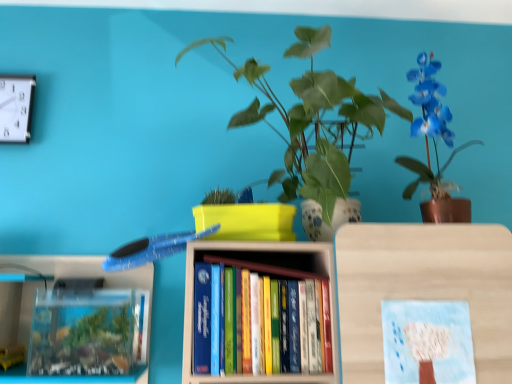
This screenshot has height=384, width=512. What are the coordinates of `pastel blue paper at center` in the screenshot? It's located at (426, 342).

Measure the distance between blue glossy orchid at upper right and camera.

The depth of blue glossy orchid at upper right is 3.54 feet.

Identify the location of green leafy plant at upper center. This screenshot has height=384, width=512. (209, 114).

Identify the location of white plastic clock at upper left. The height and width of the screenshot is (384, 512). (16, 107).

The height and width of the screenshot is (384, 512). Identify the location of pastel blue paper at center. (426, 342).

Can you confirm if green leafy plant at upper center is wider than pastel blue paper at center?

Indeed, green leafy plant at upper center has a greater width compared to pastel blue paper at center.

Is green leafy plant at upper center positioned behind pastel blue paper at center?

No, it is not.

Looking at this image, would you say green leafy plant at upper center is a long distance from pastel blue paper at center?

No, there isn't a large distance between green leafy plant at upper center and pastel blue paper at center.

At what (x,y) coordinates should I click in order to perform the action: click on backdrop on the left of pastel blue paper at center. Please return your answer as a coordinate pair (x, y). Looking at the image, I should click on (209, 114).

Does blue glossy orchid at upper right have a lesser width compared to pastel blue paper at center?

No.

In terms of height, does blue glossy orchid at upper right look taller or shorter compared to pastel blue paper at center?

Clearly, blue glossy orchid at upper right is taller compared to pastel blue paper at center.

How different are the orientations of blue glossy orchid at upper right and pastel blue paper at center in degrees?

They differ by 0.00363 degrees in their facing directions.

Which is behind, point (436, 89) or point (436, 344)?

Point (436, 89)

You are a GUI agent. You are given a task and a screenshot of the screen. Output one action in this format:
    pyautogui.click(x=<x>, y=<y>)
    Task: Click on the clock on the left side of green leafy plant at upper center
    The image size is (512, 384).
    Given the screenshot: What is the action you would take?
    pyautogui.click(x=16, y=107)

In the scene shown: Is green leafy plant at upper center surrounded by white plastic clock at upper left?

No, green leafy plant at upper center is not a part of white plastic clock at upper left.

Does white plastic clock at upper left turn towards green leafy plant at upper center?

No, white plastic clock at upper left does not turn towards green leafy plant at upper center.

How much distance is there between white plastic clock at upper left and green leafy plant at upper center?

white plastic clock at upper left and green leafy plant at upper center are 22.96 inches apart from each other.

From a real-world perspective, does pastel blue paper at center stand above white plastic clock at upper left?

No.

Is pastel blue paper at center turned away from white plastic clock at upper left?

No.

Does pastel blue paper at center have a smaller size compared to white plastic clock at upper left?

Indeed, pastel blue paper at center has a smaller size compared to white plastic clock at upper left.

From a real-world perspective, is green leafy plant at upper center physically located above or below blue glossy orchid at upper right?

green leafy plant at upper center is situated lower than blue glossy orchid at upper right in the real world.

Based on the photo, which point is more distant from viewer, [172,55] or [443,125]?

The point [172,55] is behind.

You are a GUI agent. You are given a task and a screenshot of the screen. Output one action in this format:
    pyautogui.click(x=<x>, y=<y>)
    Task: Click on the houseplant located behind the green leafy plant at upper center
    Image resolution: width=512 pixels, height=384 pixels.
    Given the screenshot: What is the action you would take?
    pyautogui.click(x=434, y=146)

Considering the relative sizes of white plastic clock at upper left and pastel blue paper at center in the image provided, is white plastic clock at upper left taller than pastel blue paper at center?

In fact, white plastic clock at upper left may be shorter than pastel blue paper at center.

You are a GUI agent. You are given a task and a screenshot of the screen. Output one action in this format:
    pyautogui.click(x=<x>, y=<y>)
    Task: Click on the book cover below the white plastic clock at upper left (from the image's perspective)
    This screenshot has width=512, height=384.
    Given the screenshot: What is the action you would take?
    pyautogui.click(x=426, y=342)

Are white plastic clock at upper left and pastel blue paper at center located far from each other?

Absolutely, white plastic clock at upper left is distant from pastel blue paper at center.

From a real-world perspective, which is physically above, hardcover books at center or white plastic clock at upper left?

In real-world perspective, white plastic clock at upper left is above.

In the scene shown: Is white plastic clock at upper left surrounded by hardcover books at center?

No.

What's the angular difference between hardcover books at center and white plastic clock at upper left's facing directions?

hardcover books at center and white plastic clock at upper left are facing 0.00312 degrees away from each other.

Relative to white plastic clock at upper left, is hardcover books at center in front or behind?

Clearly, hardcover books at center is in front of white plastic clock at upper left.

Locate an element on the screen. The image size is (512, 384). backdrop in front of the pastel blue paper at center is located at coordinates (209, 114).

In order to click on houseplant above the pastel blue paper at center (from the image's perspective) in this screenshot , I will do `click(434, 146)`.

Estimate the real-world distances between objects in this image. Which object is closer to pastel blue paper at center, green leafy plant at upper center or white plastic clock at upper left?

Among the two, green leafy plant at upper center is located nearer to pastel blue paper at center.

Estimate the real-world distances between objects in this image. Which object is further from green leafy plant at upper center, blue glossy orchid at upper right or white plastic clock at upper left?

white plastic clock at upper left is positioned further to the anchor green leafy plant at upper center.

Considering their positions, is pastel blue paper at center positioned further to green leafy plant at upper center than white plastic clock at upper left?

The object further to green leafy plant at upper center is pastel blue paper at center.

Based on their spatial positions, is green leafy plant at upper center or hardcover books at center closer to white plastic clock at upper left?

green leafy plant at upper center.

From the image, which object appears to be nearer to green leafy plant at upper center, white plastic clock at upper left or blue glossy orchid at upper right?

The object closer to green leafy plant at upper center is blue glossy orchid at upper right.

In the scene shown: Looking at the image, which one is located closer to green leafy plant at upper center, hardcover books at center or white plastic clock at upper left?

hardcover books at center is closer to green leafy plant at upper center.

Based on their spatial positions, is white plastic clock at upper left or pastel blue paper at center further from hardcover books at center?

Based on the image, white plastic clock at upper left appears to be further to hardcover books at center.

From the image, which object appears to be nearer to blue glossy orchid at upper right, hardcover books at center or white plastic clock at upper left?

hardcover books at center is positioned closer to the anchor blue glossy orchid at upper right.

Find the location of a particular element. The width and height of the screenshot is (512, 384). backdrop between white plastic clock at upper left and blue glossy orchid at upper right in the horizontal direction is located at coordinates (209, 114).

At what (x,y) coordinates should I click in order to perform the action: click on backdrop between white plastic clock at upper left and pastel blue paper at center in the horizontal direction. Please return your answer as a coordinate pair (x, y). The width and height of the screenshot is (512, 384). Looking at the image, I should click on (209, 114).

Where is `book between green leafy plant at upper center and pastel blue paper at center in the up-down direction`? The height and width of the screenshot is (384, 512). book between green leafy plant at upper center and pastel blue paper at center in the up-down direction is located at coordinates (265, 314).

Locate an element on the screen. The image size is (512, 384). book between blue glossy orchid at upper right and pastel blue paper at center in the vertical direction is located at coordinates (265, 314).